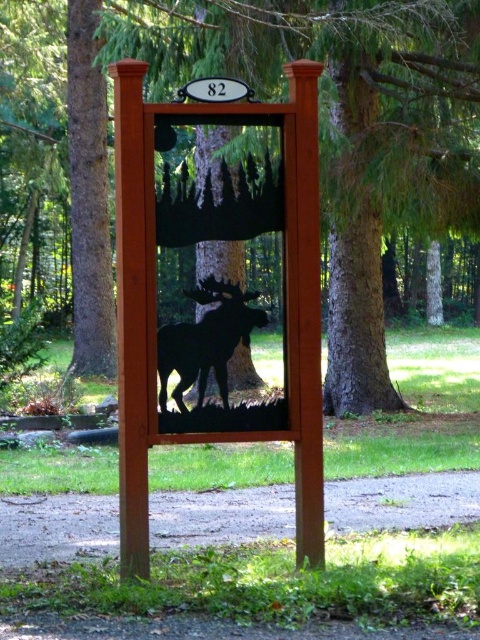
Does point (167, 433) come in front of point (176, 390)?

Yes, it is.

Can you confirm if matte wood sign at center is shorter than black matte moose at center?

In fact, matte wood sign at center may be taller than black matte moose at center.

Find the location of `matte wood sign at center`. matte wood sign at center is located at coordinates (219, 320).

Looking at this image, which is above, brown wood tree at center or black matte moose at center?

brown wood tree at center is above.

Between point (360, 225) and point (227, 381), which one is positioned in front?

Point (227, 381)

Locate an element on the screen. brown wood tree at center is located at coordinates (342, 125).

Between brown wood tree at center and matte wood sign at center, which one is positioned higher?

brown wood tree at center

Is point (422, 28) positioned after point (134, 198)?

Yes, point (422, 28) is behind point (134, 198).

Who is more forward, (x=335, y=340) or (x=316, y=140)?

Point (x=316, y=140) is more forward.

The height and width of the screenshot is (640, 480). Identify the location of brown wood tree at center. (342, 125).